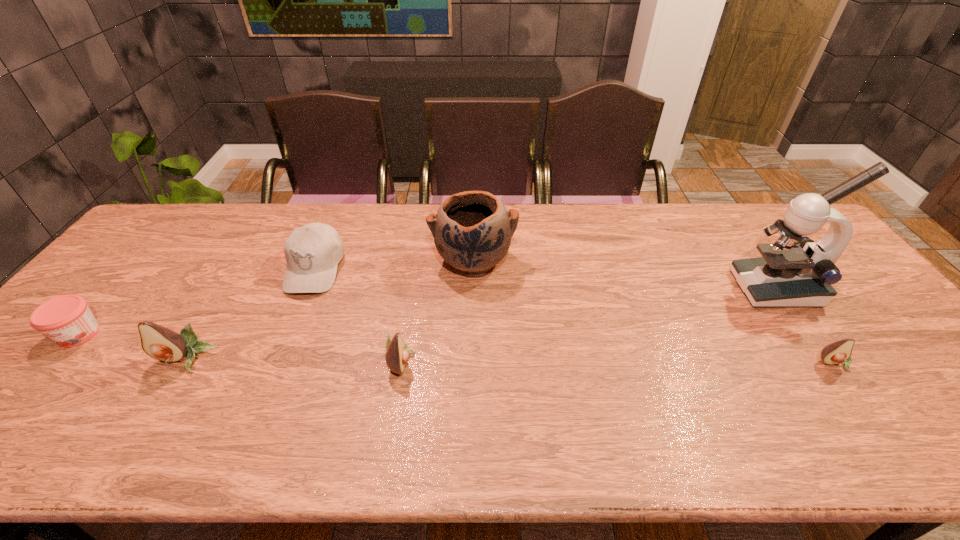
Locate an element on the screen. The image size is (960, 540). object located at the right edge is located at coordinates (795, 271).

In order to click on free space at the far edge of the desktop in this screenshot , I will do `click(608, 220)`.

In the image, there is a desktop. Identify the location of vacant space at the near edge. The image size is (960, 540). (329, 391).

Identify the location of free space at the far left corner of the desktop. Image resolution: width=960 pixels, height=540 pixels. (164, 213).

The height and width of the screenshot is (540, 960). In order to click on blank region between the jam and the fourth object from left to right in this screenshot , I will do `click(240, 347)`.

Where is `vacant space that is in between the second avocado from right to left and the rightmost avocado`? The height and width of the screenshot is (540, 960). vacant space that is in between the second avocado from right to left and the rightmost avocado is located at coordinates (618, 362).

Image resolution: width=960 pixels, height=540 pixels. What are the coordinates of `free point between the rightmost avocado and the tallest object` in the screenshot? It's located at (804, 326).

Where is `vacant area that lies between the microscope and the leftmost avocado`? vacant area that lies between the microscope and the leftmost avocado is located at coordinates (481, 324).

Locate an element on the screen. This screenshot has height=540, width=960. free space between the jam and the shortest avocado is located at coordinates pos(457,349).

The height and width of the screenshot is (540, 960). What are the coordinates of `blank region between the fourth object from left to right and the microscope` in the screenshot? It's located at tap(588, 325).